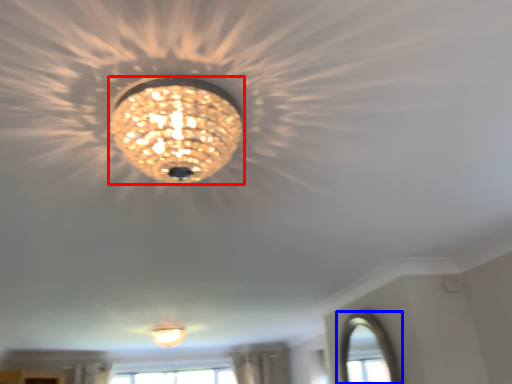
Question: Among these objects, which one is nearest to the camera, lamp (highlighted by a red box) or window (highlighted by a blue box)?

Choices:
 (A) lamp
 (B) window

Answer: (A)